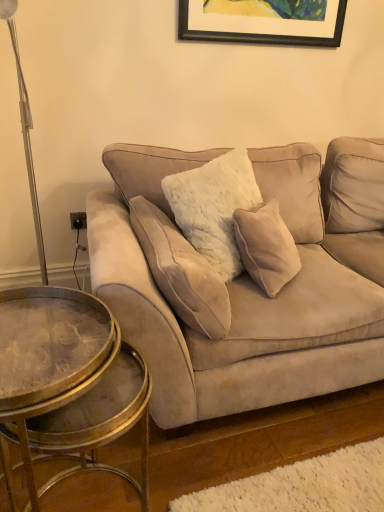
Question: From a real-world perspective, is velvet beige pillow at center physically located above or below suede couch at center?

Choices:
 (A) below
 (B) above

Answer: (B)

Question: In terms of width, does velvet beige pillow at center look wider or thinner when compared to suede couch at center?

Choices:
 (A) thin
 (B) wide

Answer: (A)

Question: Based on their relative distances, which object is farther from the metallic glass coffee table at lower left?

Choices:
 (A) velvet beige pillow at center
 (B) suede couch at center

Answer: (B)

Question: Estimate the real-world distances between objects in this image. Which object is closer to the metallic glass coffee table at lower left?

Choices:
 (A) velvet beige pillow at center
 (B) suede couch at center

Answer: (A)